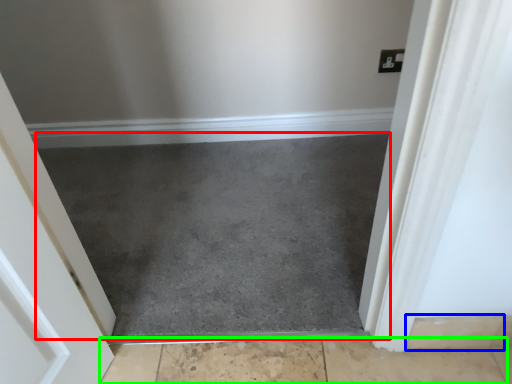
Question: Which is farther away from slate (highlighted by a red box)? concrete (highlighted by a blue box) or concrete (highlighted by a green box)?

Choices:
 (A) concrete
 (B) concrete

Answer: (A)